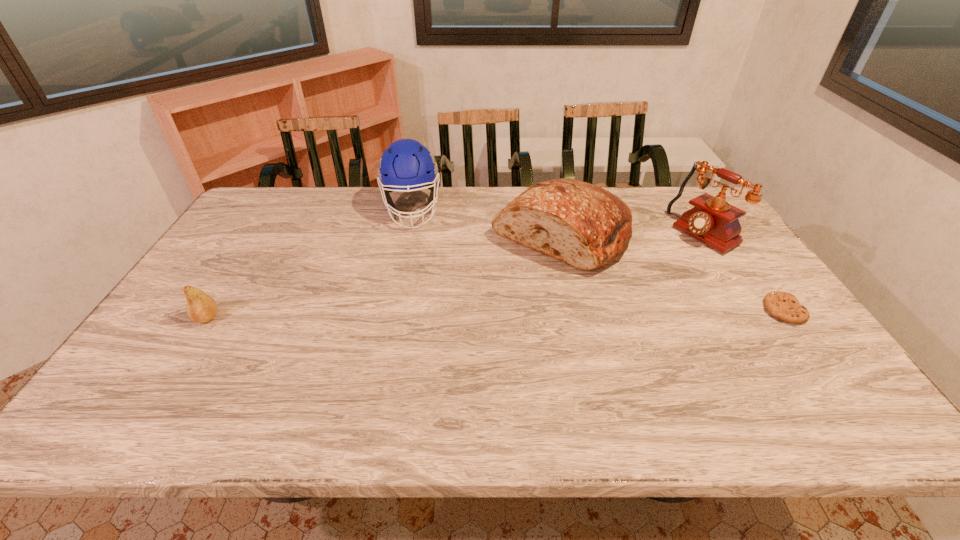
Locate an element on the screen. The width and height of the screenshot is (960, 540). vacant space located 0.100m at the sliced front of the third tallest object is located at coordinates (494, 283).

Where is `vacant space located at the sliced front of the third tallest object`? The image size is (960, 540). vacant space located at the sliced front of the third tallest object is located at coordinates (491, 286).

At what (x,y) coordinates should I click in order to perform the action: click on blank area located 0.180m on the face guard of the football helmet. Please return your answer as a coordinate pair (x, y). The width and height of the screenshot is (960, 540). Looking at the image, I should click on (413, 268).

Where is `vacant space located 0.100m on the face guard of the football helmet`? vacant space located 0.100m on the face guard of the football helmet is located at coordinates (412, 252).

Image resolution: width=960 pixels, height=540 pixels. In order to click on free region located on the face guard of the football helmet in this screenshot , I will do `click(414, 293)`.

Where is `vacant position located on the dial of the telephone`? vacant position located on the dial of the telephone is located at coordinates (602, 293).

Image resolution: width=960 pixels, height=540 pixels. I want to click on vacant area located on the dial of the telephone, so click(x=619, y=284).

The height and width of the screenshot is (540, 960). Find the location of `free space located 0.370m on the dial of the telephone`. free space located 0.370m on the dial of the telephone is located at coordinates (605, 292).

The image size is (960, 540). I want to click on bread located in the far edge section of the desktop, so click(x=585, y=226).

Locate an element on the screen. This screenshot has width=960, height=540. football helmet at the far edge is located at coordinates (406, 164).